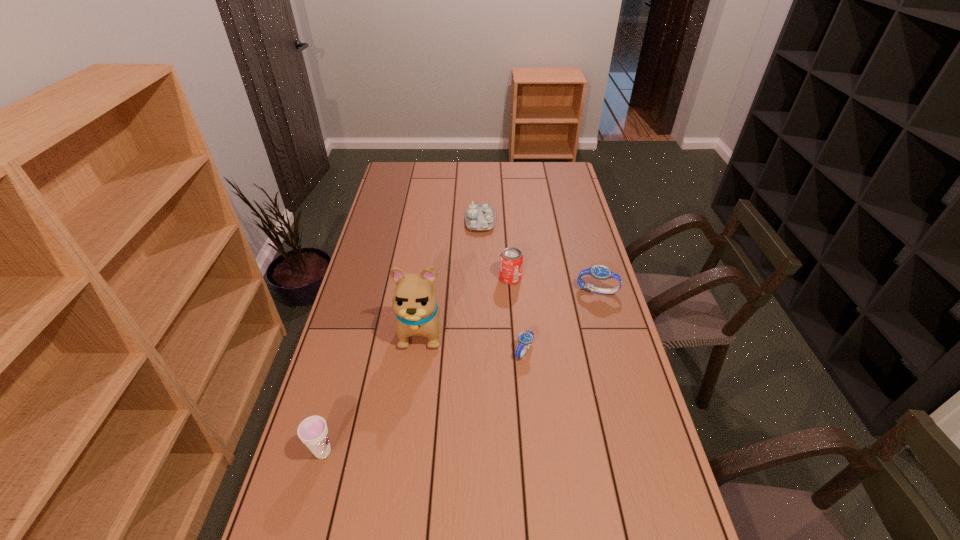
This screenshot has height=540, width=960. I want to click on free location at the near edge of the desktop, so click(408, 538).

At what (x,y) coordinates should I click in order to perform the action: click on free spot at the left edge of the desktop. Please return your answer as a coordinate pair (x, y). Image resolution: width=960 pixels, height=540 pixels. Looking at the image, I should click on (384, 320).

The image size is (960, 540). In the image, there is a desktop. In order to click on free space at the right edge in this screenshot , I will do `click(574, 195)`.

Locate an element on the screen. The image size is (960, 540). vacant region at the far right corner of the desktop is located at coordinates (562, 169).

The image size is (960, 540). Identify the location of empty space that is in between the can and the second object from left to right. (467, 302).

This screenshot has width=960, height=540. I want to click on free space between the tallest object and the rightmost object, so click(510, 309).

At what (x,y) coordinates should I click in order to perform the action: click on free area in between the chinaware and the left watch. Please return your answer as a coordinate pair (x, y). Looking at the image, I should click on (502, 286).

Locate an element on the screen. The image size is (960, 540). unoccupied area between the right watch and the shortest object is located at coordinates click(x=561, y=321).

Find the location of a particular element. The height and width of the screenshot is (540, 960). free spot between the shorter watch and the cup is located at coordinates (423, 401).

Find the location of a particular element. vacant area that lies between the shortest object and the right watch is located at coordinates (561, 321).